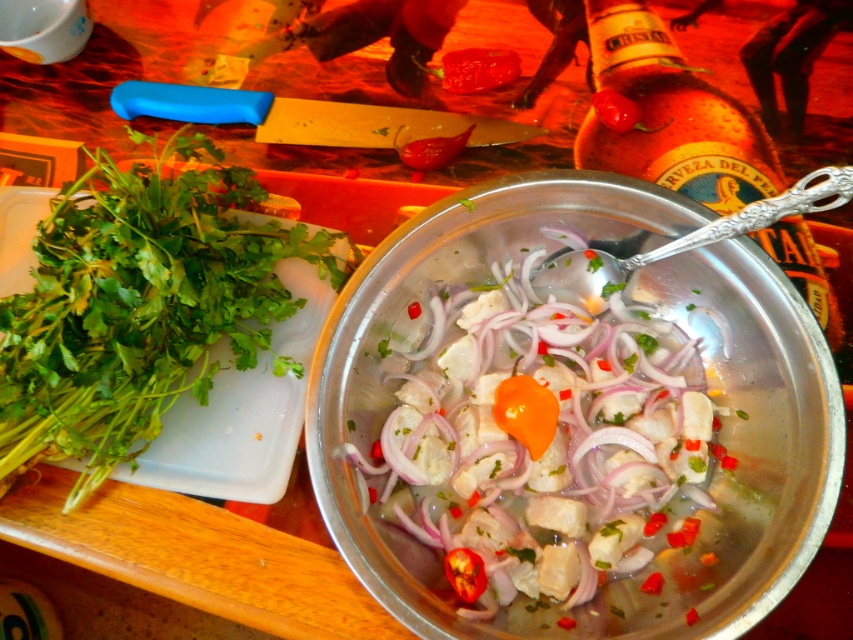
Measure the distance from amber glass bottle at center to bright red pepper at center.

amber glass bottle at center is 6.61 inches from bright red pepper at center.

Is point (587, 3) in front of point (485, 68)?

No.

What are the coordinates of `amber glass bottle at center` in the screenshot? It's located at (670, 115).

Is point (643, 451) farther from camera compared to point (746, 140)?

No.

Which of these two, white glossy fish at center or amber glass bottle at center, stands shorter?

white glossy fish at center is shorter.

Which is behind, point (654, 352) or point (645, 28)?

The point (645, 28) is behind.

You are a GUI agent. You are given a task and a screenshot of the screen. Output one action in this format:
    pyautogui.click(x=<x>, y=<y>)
    Task: Click on the white glossy fish at center
    
    Given the screenshot: What is the action you would take?
    pyautogui.click(x=541, y=442)

Between white glossy fish at center and green leafy herb at left, which one appears on the left side from the viewer's perspective?

green leafy herb at left is more to the left.

Which of these two, white glossy fish at center or green leafy herb at left, stands taller?

Standing taller between the two is green leafy herb at left.

Who is more distant from viewer, (483,532) or (126,230)?

The point (126,230) is behind.

This screenshot has height=640, width=853. In order to click on white glossy fish at center in this screenshot , I will do `click(541, 442)`.